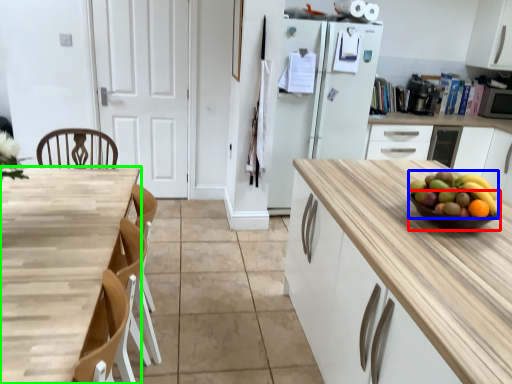
Question: Which object is the closest to the glass bowl (highlighted by a red box)? Choose among these: grapefruit (highlighted by a blue box) or countertop (highlighted by a green box).

Choices:
 (A) grapefruit
 (B) countertop

Answer: (A)